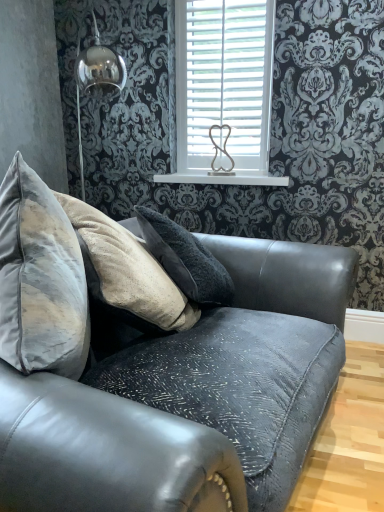
Question: Is white wooden blinds at upper center in front of or behind velvet grey couch at center in the image?

Choices:
 (A) front
 (B) behind

Answer: (B)

Question: Would you say white wooden blinds at upper center is to the left or to the right of velvet grey couch at center in the picture?

Choices:
 (A) left
 (B) right

Answer: (B)

Question: Based on their relative distances, which object is nearer to the white glossy shelf at upper center?

Choices:
 (A) white wooden blinds at upper center
 (B) velvet grey couch at center

Answer: (A)

Question: Which object is the closest to the velvet grey couch at center?

Choices:
 (A) white glossy shelf at upper center
 (B) white wooden blinds at upper center

Answer: (B)